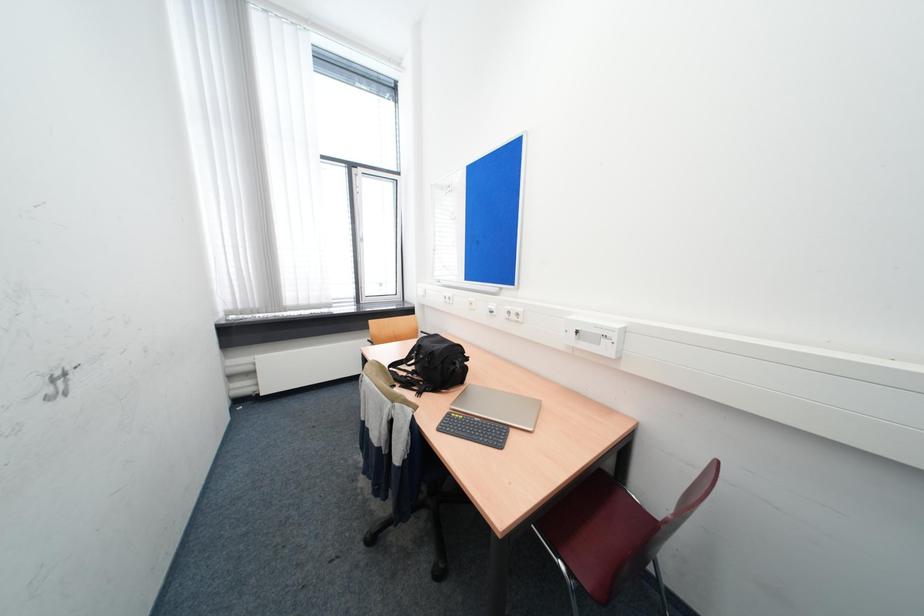
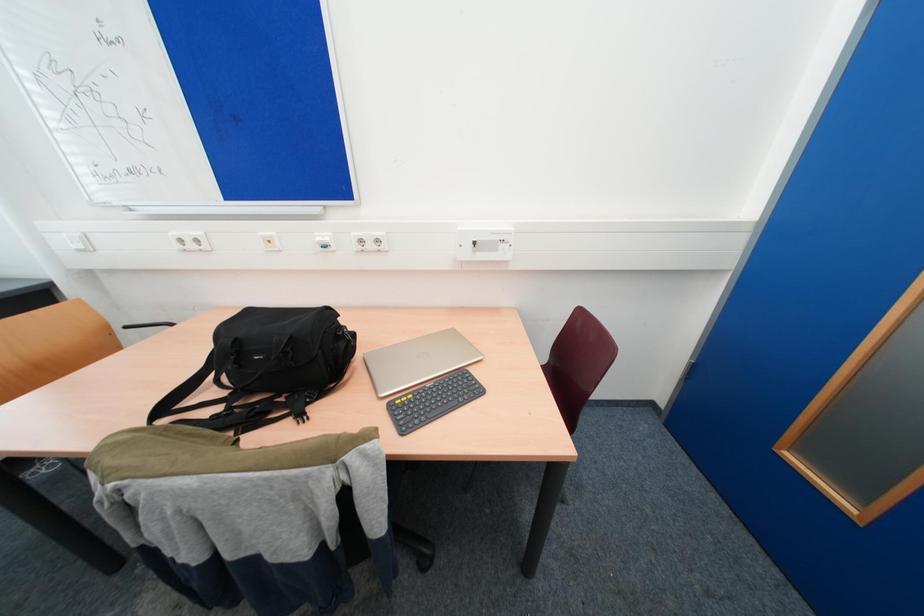
First-person continuous shooting, in which direction is the camera rotating?

The camera's rotation is toward right-down.